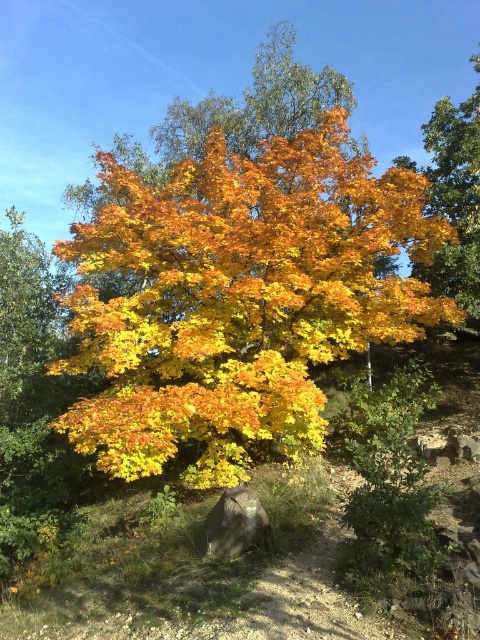
Question: Does golden yellow leaves at center lie behind gray rough rock at lower center?

Choices:
 (A) yes
 (B) no

Answer: (A)

Question: Can you confirm if golden yellow leaves at center is bigger than gray rough rock at lower center?

Choices:
 (A) no
 (B) yes

Answer: (B)

Question: Where is golden yellow leaves at center located in relation to gray rough rock at lower center in the image?

Choices:
 (A) left
 (B) right

Answer: (A)

Question: Which of the following is the farthest from the observer?

Choices:
 (A) golden yellow leaves at center
 (B) gray rough rock at lower center

Answer: (A)

Question: Which of the following is the farthest from the observer?

Choices:
 (A) gray rough rock at lower center
 (B) golden yellow leaves at center

Answer: (B)

Question: Which of the following is the farthest from the observer?

Choices:
 (A) gray rough rock at lower center
 (B) golden yellow leaves at center

Answer: (B)